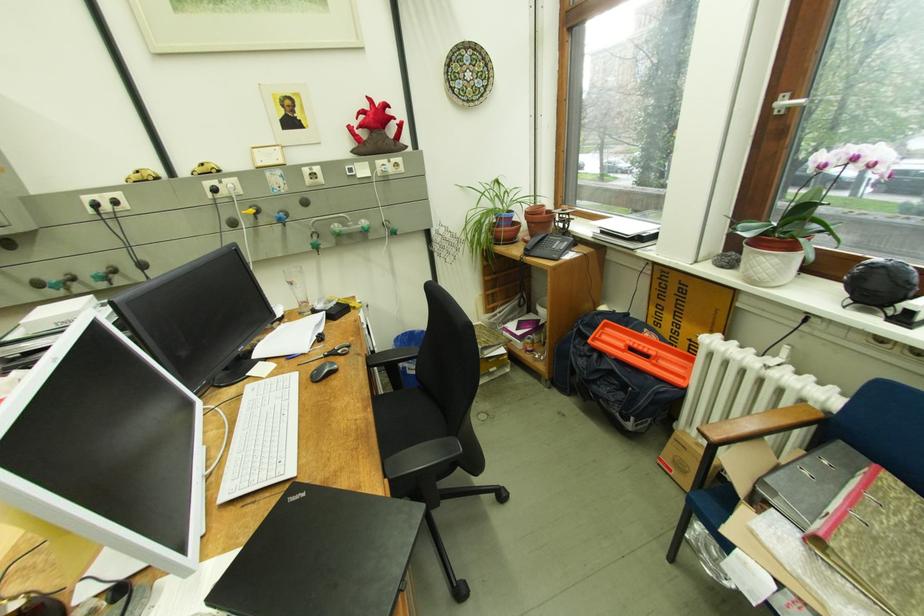
Find where to lift the orange plastic handle. Please return your answer as a coordinate pair (x, y).

(641, 352)